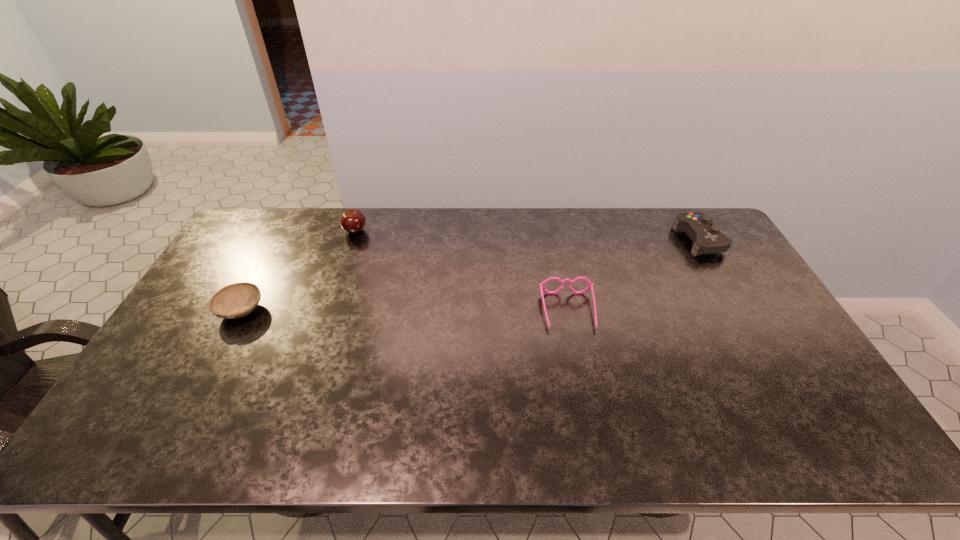
The width and height of the screenshot is (960, 540). I want to click on free space between the second object from left to right and the control, so click(x=527, y=236).

Image resolution: width=960 pixels, height=540 pixels. In order to click on free point between the third object from right to left and the control in this screenshot , I will do `click(527, 236)`.

The image size is (960, 540). Identify the location of free space between the third object from right to left and the rightmost object. (527, 236).

Where is `unoccupied position between the rightmost object and the apple`? The width and height of the screenshot is (960, 540). unoccupied position between the rightmost object and the apple is located at coordinates (527, 236).

The width and height of the screenshot is (960, 540). Find the location of `vacant space in between the bowl and the rightmost object`. vacant space in between the bowl and the rightmost object is located at coordinates (470, 275).

Find the location of `vacant point located between the leftmost object and the apple`. vacant point located between the leftmost object and the apple is located at coordinates (299, 271).

Find the location of a particular element. vacant space that is in between the shortest object and the control is located at coordinates (470, 275).

Where is `vacant point located between the apple and the third tallest object`? vacant point located between the apple and the third tallest object is located at coordinates (462, 271).

I want to click on free space between the third object from right to left and the shortest object, so 299,271.

Identify which object is located as the third nearest to the spectacles. Please provide its 2D coordinates. Your answer should be formatted as a tuple, i.e. [(x, y)], where the tuple contains the x and y coordinates of a point satisfying the conditions above.

[(234, 301)]